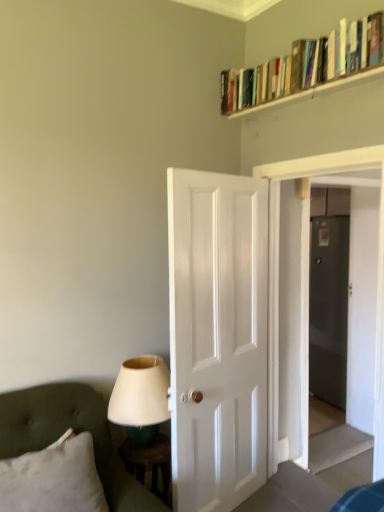
Identify the location of white matte door at center. (217, 337).

Measure the distance between matte white lampshade at lower left and camera.

The distance of matte white lampshade at lower left from camera is 6.56 feet.

What do you see at coordinates (75, 432) in the screenshot?
I see `green tufted fabric at lower left` at bounding box center [75, 432].

Describe the element at coordinates (149, 462) in the screenshot. I see `wooden stool at lower left` at that location.

Measure the distance between point [166,489] and camera.

The distance of point [166,489] from camera is 2.16 meters.

Where is `white soft pillow at lower left`? This screenshot has height=512, width=384. white soft pillow at lower left is located at coordinates (53, 479).

Is wooden stool at lower left oriented away from green tufted fabric at lower left?

No, wooden stool at lower left is not facing the opposite direction of green tufted fabric at lower left.

At what (x,y) coordinates should I click in order to perform the action: click on table behind the green tufted fabric at lower left. Please return your answer as a coordinate pair (x, y). Image resolution: width=384 pixels, height=512 pixels. Looking at the image, I should click on (149, 462).

From the image's perspective, relative to green tufted fabric at lower left, is wooden stool at lower left above or below?

From the image's perspective, wooden stool at lower left appears below green tufted fabric at lower left.

Considering the sizes of objects wooden stool at lower left and green tufted fabric at lower left in the image provided, who is thinner, wooden stool at lower left or green tufted fabric at lower left?

wooden stool at lower left.

From a real-world perspective, relative to wooden stool at lower left, is white matte door at center vertically above or below?

From a real-world perspective, white matte door at center is physically above wooden stool at lower left.

In the scene shown: From the image's perspective, between white matte door at center and wooden stool at lower left, who is located below?

From the image's view, wooden stool at lower left is below.

Considering the relative sizes of white matte door at center and wooden stool at lower left in the image provided, is white matte door at center wider than wooden stool at lower left?

No.

How many degrees apart are the facing directions of white matte door at center and green tufted fabric at lower left?

white matte door at center and green tufted fabric at lower left are facing 19.7 degrees away from each other.

Based on the photo, is the depth of white matte door at center less than that of green tufted fabric at lower left?

No, white matte door at center is further to the viewer.

Which is further, (x=234, y=198) or (x=101, y=398)?

Positioned behind is point (x=234, y=198).

Is green tufted fabric at lower left completely or partially inside white matte door at center?

Actually, green tufted fabric at lower left is outside white matte door at center.

Considering the sizes of objects transparent glass door at center, which is the 2th glass door in back-to-front order, and matte gray glass door at right, the 1th glass door from the back, in the image provided, who is smaller, transparent glass door at center, which is the 2th glass door in back-to-front order, or matte gray glass door at right, the 1th glass door from the back,?

matte gray glass door at right, the 1th glass door from the back.

Is transparent glass door at center, which is the 2th glass door in back-to-front order, positioned behind matte gray glass door at right, the 1th glass door from the back?

No, transparent glass door at center, which is the 2th glass door in back-to-front order, is in front of matte gray glass door at right, the 1th glass door from the back.

Is transparent glass door at center, which ranks as the 1th glass door in front-to-back order, touching matte gray glass door at right, the 1th glass door from the back?

No, transparent glass door at center, which ranks as the 1th glass door in front-to-back order, is not making contact with matte gray glass door at right, the 1th glass door from the back.

Is transparent glass door at center, which is the 2th glass door in back-to-front order, inside the boundaries of matte gray glass door at right, the 1th glass door from the back, or outside?

transparent glass door at center, which is the 2th glass door in back-to-front order, cannot be found inside matte gray glass door at right, the 1th glass door from the back.

Considering the relative sizes of white soft pillow at lower left and wooden bookshelf at upper right in the image provided, is white soft pillow at lower left smaller than wooden bookshelf at upper right?

Actually, white soft pillow at lower left might be larger than wooden bookshelf at upper right.

From the image's perspective, relative to wooden bookshelf at upper right, is white soft pillow at lower left above or below?

Based on their image positions, white soft pillow at lower left is located beneath wooden bookshelf at upper right.

The image size is (384, 512). Find the location of `pillow located underneath the wooden bookshelf at upper right (from a real-world perspective)`. pillow located underneath the wooden bookshelf at upper right (from a real-world perspective) is located at coordinates (53, 479).

From a real-world perspective, relative to wooden bookshelf at upper right, is white soft pillow at lower left vertically above or below?

From a real-world perspective, white soft pillow at lower left is physically below wooden bookshelf at upper right.

Which object is positioned more to the left, matte gray glass door at right, the second glass door from the front, or wooden stool at lower left?

wooden stool at lower left.

At what (x,y) coordinates should I click in order to perform the action: click on table that is below the matte gray glass door at right, the 1th glass door from the back (from the image's perspective). Please return your answer as a coordinate pair (x, y). The image size is (384, 512). Looking at the image, I should click on (149, 462).

Can you confirm if matte gray glass door at right, the 1th glass door from the back, is bigger than wooden stool at lower left?

Incorrect, matte gray glass door at right, the 1th glass door from the back, is not larger than wooden stool at lower left.

Does matte gray glass door at right, the second glass door from the front, lie behind wooden stool at lower left?

Yes, matte gray glass door at right, the second glass door from the front, is further from the viewer.

Is point (372, 308) closer to viewer compared to point (156, 452)?

No, (372, 308) is further to viewer.

Who is bigger, transparent glass door at center, which is the 2th glass door in back-to-front order, or wooden stool at lower left?

transparent glass door at center, which is the 2th glass door in back-to-front order, is bigger.

Is transparent glass door at center, which ranks as the 1th glass door in front-to-back order, located outside wooden stool at lower left?

transparent glass door at center, which ranks as the 1th glass door in front-to-back order, is positioned outside wooden stool at lower left.

Starting from the wooden stool at lower left, which glass door is the 1st one to the right? Please provide its 2D coordinates.

[(364, 298)]

Find the location of a particular element. The height and width of the screenshot is (512, 384). furniture that appears above the wooden stool at lower left (from the image's perspective) is located at coordinates (75, 432).

Find the location of a particular element. The height and width of the screenshot is (512, 384). door in front of the wooden stool at lower left is located at coordinates (217, 337).

From the image, which object appears to be farther from green tufted fabric at lower left, matte white lampshade at lower left or transparent glass door at center, which is the 2th glass door in back-to-front order?

Based on the image, transparent glass door at center, which is the 2th glass door in back-to-front order, appears to be further to green tufted fabric at lower left.

Looking at this image, looking at the image, which one is located further to matte white lampshade at lower left, matte gray glass door at right, the 1th glass door from the back, or wooden stool at lower left?

Based on the image, matte gray glass door at right, the 1th glass door from the back, appears to be further to matte white lampshade at lower left.

When comparing their distances from transparent glass door at center, which is the 2th glass door in back-to-front order, does wooden bookshelf at upper right or green tufted fabric at lower left seem further?

green tufted fabric at lower left.

From the image, which object appears to be farther from wooden bookshelf at upper right, white matte door at center or matte white lampshade at lower left?

Based on the image, matte white lampshade at lower left appears to be further to wooden bookshelf at upper right.

Based on their spatial positions, is matte white lampshade at lower left or white matte door at center closer to wooden stool at lower left?

matte white lampshade at lower left lies closer to wooden stool at lower left than the other object.

Consider the image. Estimate the real-world distances between objects in this image. Which object is closer to green tufted fabric at lower left, wooden bookshelf at upper right or wooden stool at lower left?

The object closer to green tufted fabric at lower left is wooden stool at lower left.

Based on the photo, based on their spatial positions, is transparent glass door at center, which is the 2th glass door in back-to-front order, or green tufted fabric at lower left further from matte white lampshade at lower left?

transparent glass door at center, which is the 2th glass door in back-to-front order, lies further to matte white lampshade at lower left than the other object.

Which object lies further to the anchor point transparent glass door at center, which ranks as the 1th glass door in front-to-back order, wooden bookshelf at upper right or matte white lampshade at lower left?

matte white lampshade at lower left lies further to transparent glass door at center, which ranks as the 1th glass door in front-to-back order, than the other object.

Identify the location of glass door positioned between white matte door at center and matte gray glass door at right, the 1th glass door from the back, from near to far. [x=364, y=298].

Locate an element on the screen. glass door between matte white lampshade at lower left and matte gray glass door at right, the second glass door from the front, along the z-axis is located at coordinates (364, 298).

I want to click on table between white soft pillow at lower left and transparent glass door at center, which ranks as the 1th glass door in front-to-back order, from left to right, so click(x=149, y=462).

Where is `table lamp between white soft pillow at lower left and matte gray glass door at right, the 1th glass door from the back, along the z-axis`? table lamp between white soft pillow at lower left and matte gray glass door at right, the 1th glass door from the back, along the z-axis is located at coordinates (140, 398).